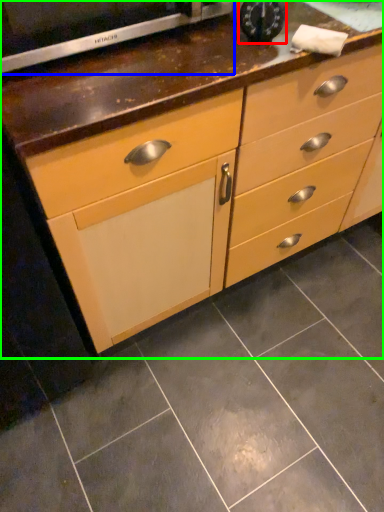
Question: Estimate the real-world distances between objects in this image. Which object is farther from appliance (highlighted by a red box), appliance (highlighted by a blue box) or chest of drawers (highlighted by a green box)?

Choices:
 (A) appliance
 (B) chest of drawers

Answer: (B)